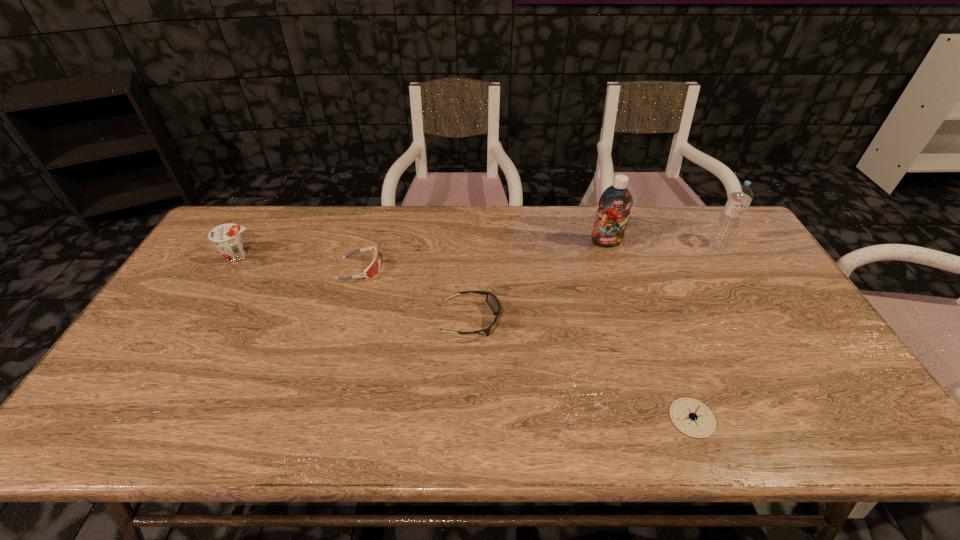
You are a GUI agent. You are given a task and a screenshot of the screen. Output one action in this format:
    pyautogui.click(x=<x>, y=<y>)
    Task: Click on the vacant area situated on the front of the rightmost object
    Image resolution: width=960 pixels, height=540 pixels.
    Given the screenshot: What is the action you would take?
    (750, 294)

I want to click on vacant space situated on the right of the yogurt, so [320, 256].

Locate an element on the screen. free location located 0.300m on the front-facing side of the fifth object from right to left is located at coordinates (478, 268).

Where is `vacant space situated 0.150m on the lenses of the nearer goggles`? The height and width of the screenshot is (540, 960). vacant space situated 0.150m on the lenses of the nearer goggles is located at coordinates (554, 320).

Identify the location of free space located on the left of the nearest object. Image resolution: width=960 pixels, height=540 pixels. (516, 418).

The height and width of the screenshot is (540, 960). Find the location of `shampoo present at the far edge`. shampoo present at the far edge is located at coordinates (614, 204).

Where is `water bottle that is at the far edge`? This screenshot has width=960, height=540. water bottle that is at the far edge is located at coordinates (741, 196).

Where is `yogurt that is at the far edge`? The width and height of the screenshot is (960, 540). yogurt that is at the far edge is located at coordinates (226, 237).

You are a GUI agent. You are given a task and a screenshot of the screen. Output one action in this format:
    pyautogui.click(x=<x>, y=<y>)
    Task: Click on the object that is at the near edge
    The image size is (960, 540).
    Given the screenshot: What is the action you would take?
    pyautogui.click(x=692, y=417)

Where is `object that is at the left edge`? Image resolution: width=960 pixels, height=540 pixels. object that is at the left edge is located at coordinates (226, 237).